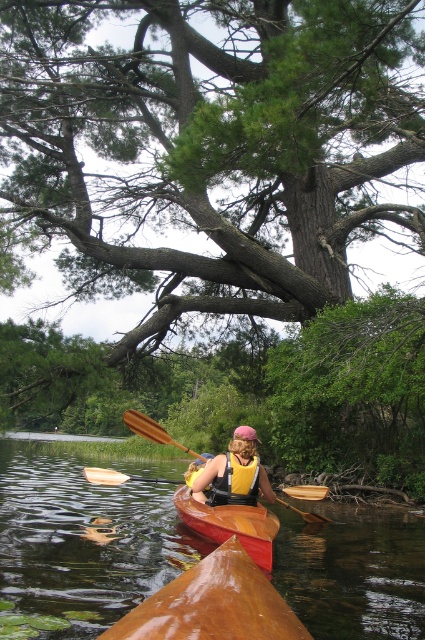
In the scene shown: Can you confirm if wooden canoe at center is positioned to the left of yellow life vest at center?

Correct, you'll find wooden canoe at center to the left of yellow life vest at center.

Is wooden canoe at center shorter than yellow life vest at center?

Yes, wooden canoe at center is shorter than yellow life vest at center.

Which is behind, point (184, 515) or point (218, 477)?

The point (184, 515) is more distant.

At what (x,y) coordinates should I click in order to perform the action: click on wooden canoe at center. Please return your answer as a coordinate pair (x, y). This screenshot has width=425, height=640. Looking at the image, I should click on (231, 524).

Can you confirm if green leafy tree at upper center is wider than brown wood paddle at center?

Indeed, green leafy tree at upper center has a greater width compared to brown wood paddle at center.

Does point (240, 29) come farther from viewer compared to point (139, 422)?

Yes, it is behind point (139, 422).

Locate an element on the screen. The width and height of the screenshot is (425, 640). green leafy tree at upper center is located at coordinates (209, 147).

Is shiny brown canoe at center further to camera compared to yellow life vest at center?

No, it is in front of yellow life vest at center.

Can you confirm if shiny brown canoe at center is shorter than yellow life vest at center?

Yes, shiny brown canoe at center is shorter than yellow life vest at center.

Who is more distant from viewer, (x=206, y=624) or (x=237, y=488)?

The point (x=237, y=488) is more distant.

The image size is (425, 640). I want to click on shiny brown canoe at center, so (x=212, y=604).